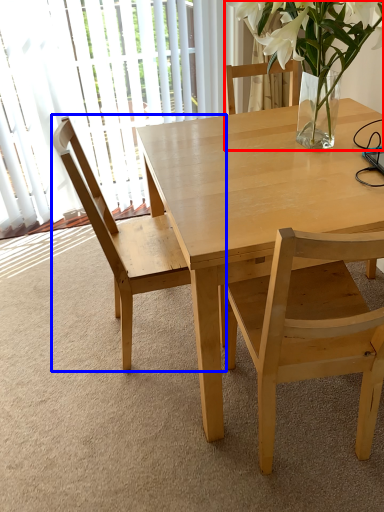
Question: Which of the following is the closest to the observer, houseplant (highlighted by a red box) or chair (highlighted by a blue box)?

Choices:
 (A) houseplant
 (B) chair

Answer: (A)